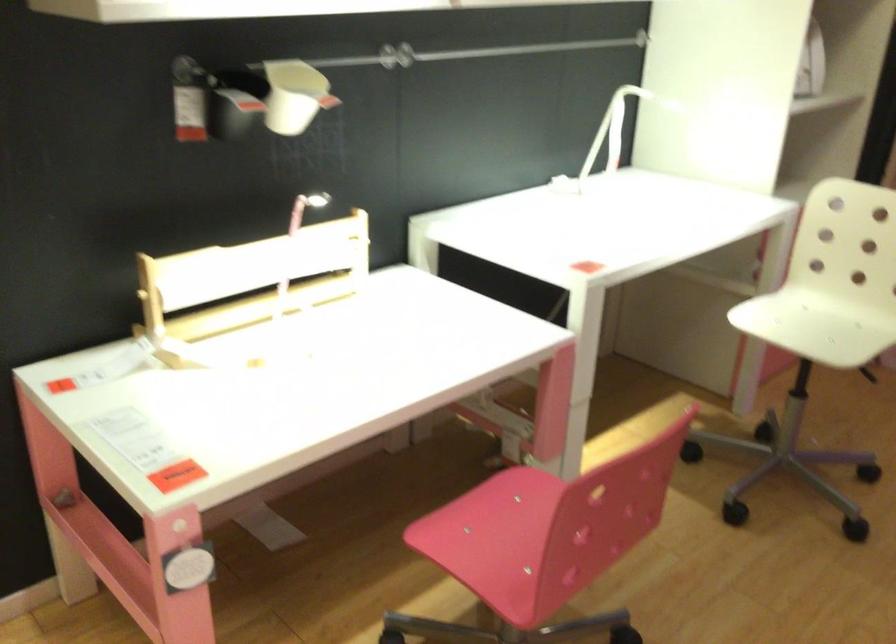
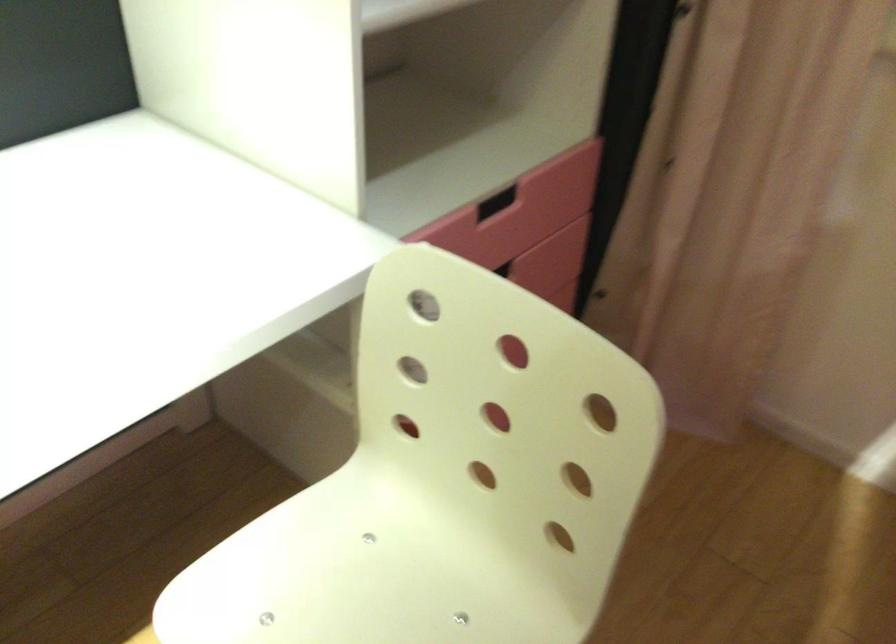
The images are taken continuously from a first-person perspective. In which direction are you moving?

The cameraman walked toward right, forward.